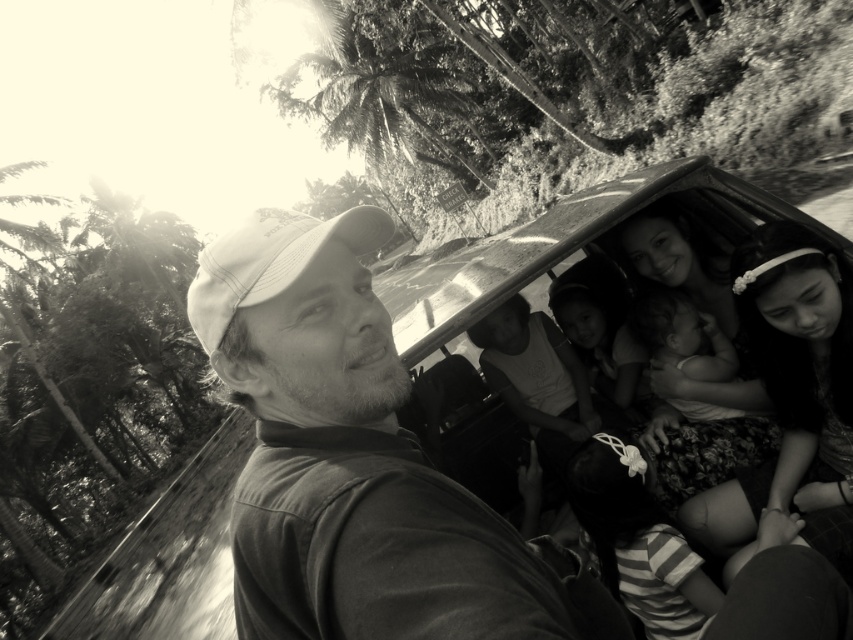
Question: Estimate the real-world distances between objects in this image. Which object is closer to the white fabric baseball cap at center?

Choices:
 (A) smooth skin child at center
 (B) metallic car at center
 (C) striped fabric shirt at lower center

Answer: (C)

Question: Can you confirm if metallic car at center is positioned above white fabric baseball cap at center?

Choices:
 (A) yes
 (B) no

Answer: (A)

Question: Based on their relative distances, which object is farther from the white fabric cap at center?

Choices:
 (A) striped fabric shirt at lower center
 (B) smooth skin child at center
 (C) metallic car at center

Answer: (B)

Question: Which point is farther to the camera?

Choices:
 (A) (494, 492)
 (B) (631, 390)
 (C) (192, 317)

Answer: (A)

Question: Is white fabric baseball cap at center below smooth skin child at center?

Choices:
 (A) no
 (B) yes

Answer: (A)

Question: Considering the relative positions of metallic car at center and striped fabric shirt at lower center in the image provided, where is metallic car at center located with respect to striped fabric shirt at lower center?

Choices:
 (A) left
 (B) right

Answer: (B)